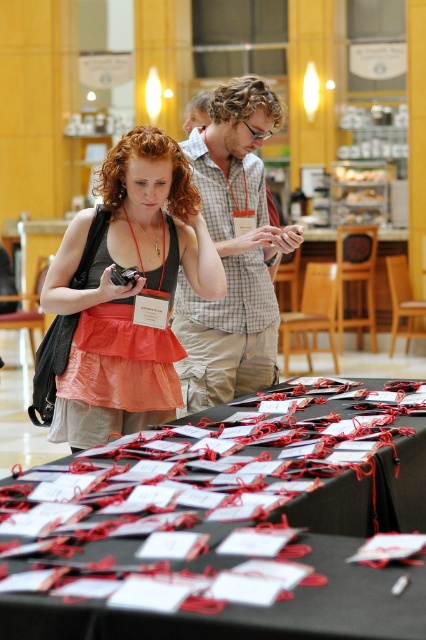
Question: Which object appears closest to the camera in this image?

Choices:
 (A) checkered fabric shirt at center
 (B) matte black camera at left
 (C) black paper bag at lower center

Answer: (C)

Question: Can you confirm if matte black camera at left is positioned above checkered fabric shirt at center?

Choices:
 (A) no
 (B) yes

Answer: (A)

Question: Which point is farther to the camera?

Choices:
 (A) tap(158, 403)
 (B) tap(252, 220)

Answer: (B)

Question: Which of the following is the closest to the observer?

Choices:
 (A) (342, 444)
 (B) (215, 256)
 (C) (250, 300)

Answer: (A)

Question: From the image, what is the correct spatial relationship of black paper bag at lower center in relation to matte black camera at left?

Choices:
 (A) right
 (B) left

Answer: (A)

Question: In this image, where is matte black camera at left located relative to checkered fabric shirt at center?

Choices:
 (A) right
 (B) left

Answer: (B)